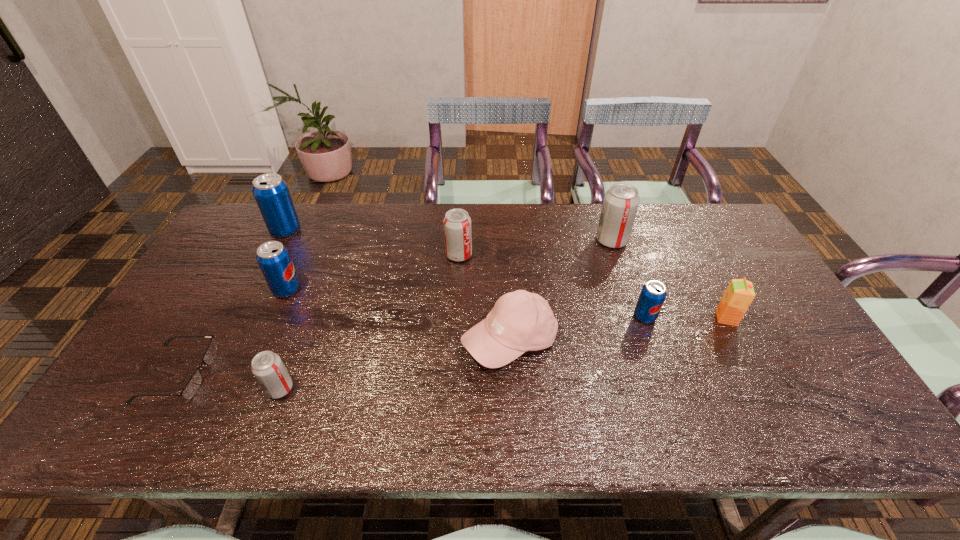
This screenshot has height=540, width=960. Find the location of `empty location between the black spectacles and the rightmost object`. empty location between the black spectacles and the rightmost object is located at coordinates (452, 346).

Find the location of `the sixth closest object to the biggest gray soda can`. the sixth closest object to the biggest gray soda can is located at coordinates (267, 367).

Select which object is the fifth closest to the pink baseball cap. Please provide its 2D coordinates. Your answer should be formatted as a tuple, i.e. [(x, y)], where the tuple contains the x and y coordinates of a point satisfying the conditions above.

[(740, 293)]

You are a GUI agent. You are given a task and a screenshot of the screen. Output one action in this format:
    pyautogui.click(x=<x>, y=<y>)
    Task: Click on the third closest soda can to the second nearest blue pop soda
    This screenshot has height=540, width=960.
    Given the screenshot: What is the action you would take?
    pyautogui.click(x=457, y=223)

Identify which soda can is located as the second nearest to the rightmost object. Please provide its 2D coordinates. Your answer should be formatted as a tuple, i.e. [(x, y)], where the tuple contains the x and y coordinates of a point satisfying the conditions above.

[(620, 205)]

Find the location of a particular element. Image resolution: width=960 pixels, height=540 pixels. blue pop soda that is the closest one to the pink baseball cap is located at coordinates tap(653, 293).

Select which blue pop soda appears as the third closest to the rightmost gray soda can. Please provide its 2D coordinates. Your answer should be formatted as a tuple, i.e. [(x, y)], where the tuple contains the x and y coordinates of a point satisfying the conditions above.

[(271, 192)]

Locate which gray soda can ranks second in proximity to the rightmost gray soda can. Please provide its 2D coordinates. Your answer should be formatted as a tuple, i.e. [(x, y)], where the tuple contains the x and y coordinates of a point satisfying the conditions above.

[(267, 367)]

I want to click on gray soda can that stands as the second closest to the pink baseball cap, so click(620, 205).

Image resolution: width=960 pixels, height=540 pixels. I want to click on free location that satisfies the following two spatial constraints: 1. on the back side of the second gray soda can from left to right; 2. on the right side of the rightmost gray soda can, so click(x=460, y=241).